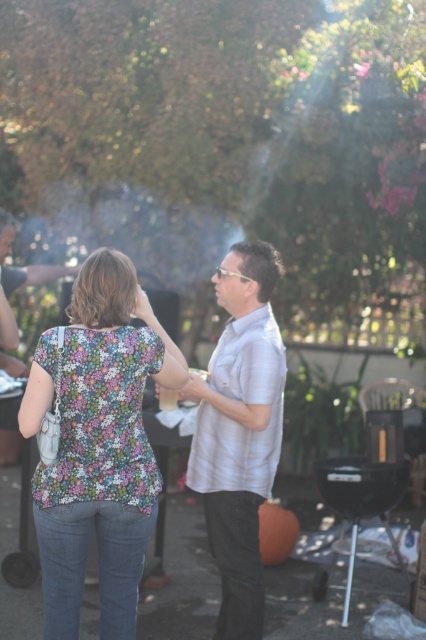
Question: Is floral fabric blouse at center behind light gray shirt at center?

Choices:
 (A) no
 (B) yes

Answer: (A)

Question: Is floral fabric blouse at center thinner than light gray shirt at center?

Choices:
 (A) yes
 (B) no

Answer: (B)

Question: Which object is closer to the camera taking this photo?

Choices:
 (A) floral fabric blouse at center
 (B) light gray shirt at center

Answer: (A)

Question: Among these objects, which one is nearest to the camera?

Choices:
 (A) light gray shirt at center
 (B) floral fabric blouse at center

Answer: (B)

Question: Does floral fabric blouse at center come in front of light gray shirt at center?

Choices:
 (A) yes
 (B) no

Answer: (A)